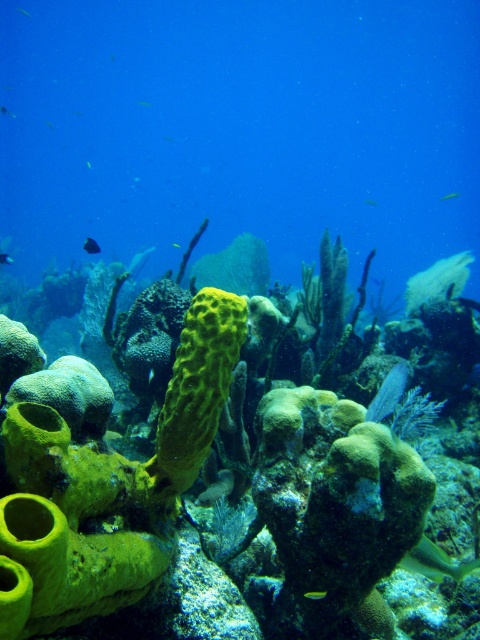
You are an underwater photographer aiming to capture both the shiny blue fish at center and the translucent yellow fish at upper left in a single frame. Given their sizes, which fish should you focus on first to ensure both fit in the shot?

The shiny blue fish at center is larger than the translucent yellow fish at upper left, so you should focus on positioning the larger fish first to ensure there is enough space for both in the frame.

You are a marine biologist observing the underwater scene. You notice a blue glossy fish at center and a translucent yellow fish at upper left. Which fish has a greater width?

The blue glossy fish at center has a greater width than the translucent yellow fish at upper left.